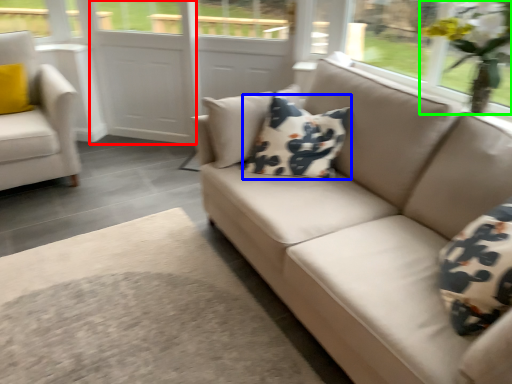
Question: Which object is the farthest from screen door (highlighted by a red box)? Choose among these: pillow (highlighted by a blue box) or floral arrangement (highlighted by a green box).

Choices:
 (A) pillow
 (B) floral arrangement

Answer: (B)